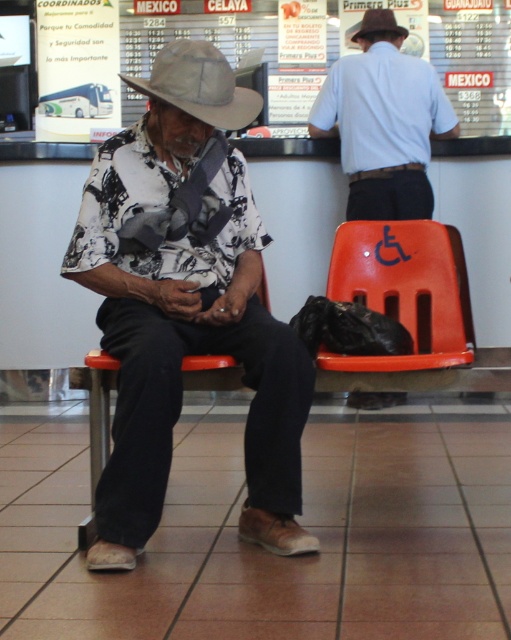
Question: Which object appears farthest from the camera in this image?

Choices:
 (A) orange plastic chair at right
 (B) light blue shirt at center
 (C) brown felt fedora at upper center
 (D) woven straw hat at left

Answer: (C)

Question: Is orange plastic chair at right smaller than brown felt fedora at upper center?

Choices:
 (A) no
 (B) yes

Answer: (A)

Question: Where is light blue shirt at center located in relation to brown felt fedora at upper center in the image?

Choices:
 (A) above
 (B) below

Answer: (B)

Question: Which of the following is the closest to the observer?

Choices:
 (A) brown felt fedora at upper center
 (B) woven straw hat at left

Answer: (B)

Question: Estimate the real-world distances between objects in this image. Which object is farther from the orange plastic chair at center?

Choices:
 (A) orange plastic chair at right
 (B) light blue shirt at center
 (C) woven straw hat at left

Answer: (B)

Question: Is orange plastic chair at right thinner than woven straw hat at left?

Choices:
 (A) yes
 (B) no

Answer: (B)